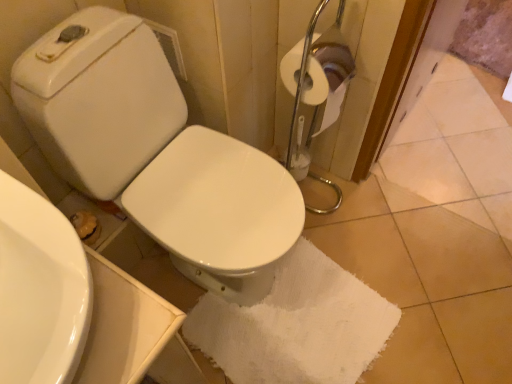
The width and height of the screenshot is (512, 384). I want to click on free space underneath white cotton bath towel at center (from a real-world perspective), so click(309, 330).